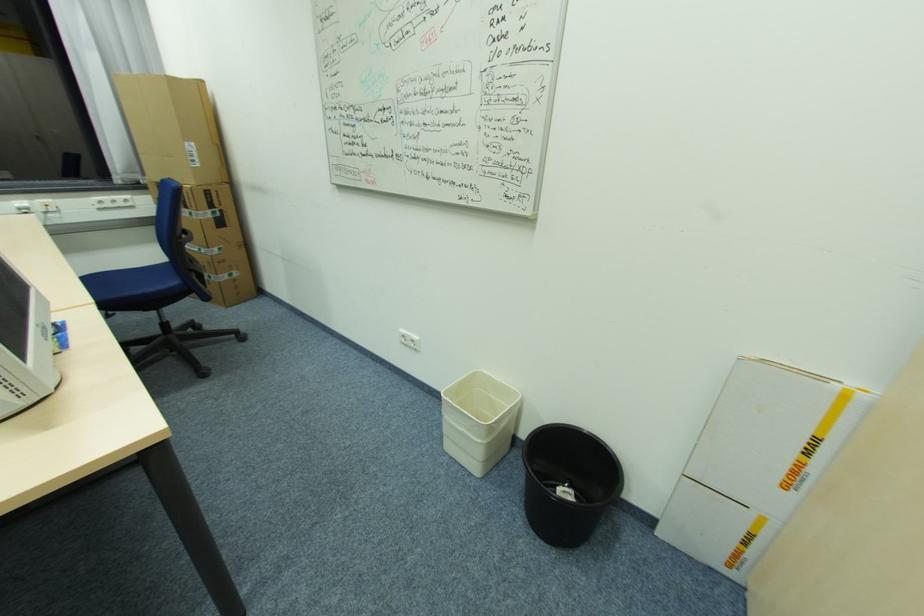
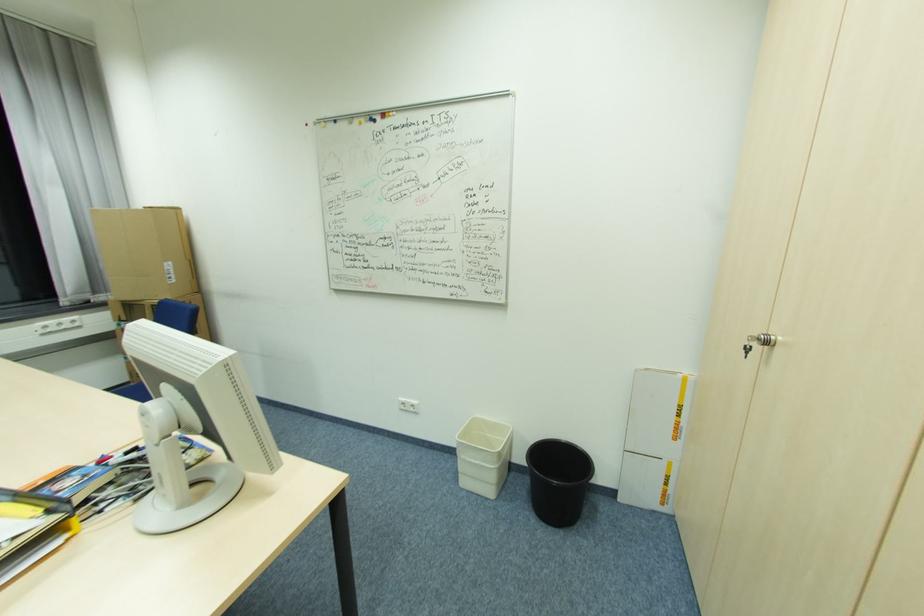
The point at (526, 514) is marked in the first image. Where is the corresponding point in the second image?

(537, 515)